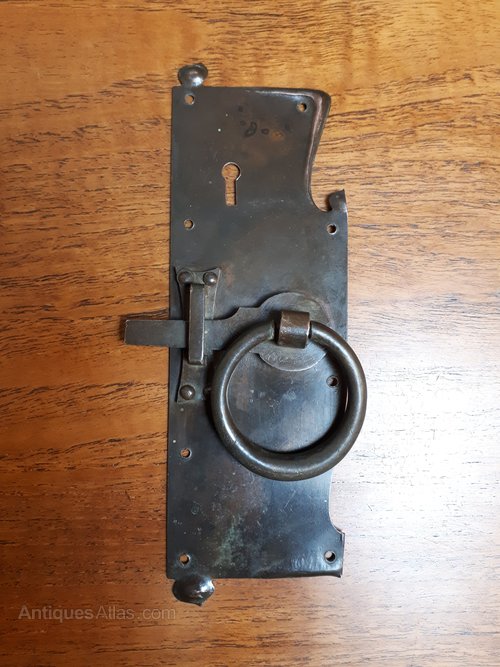
This screenshot has width=500, height=667. I want to click on wooden table, so click(x=114, y=560).